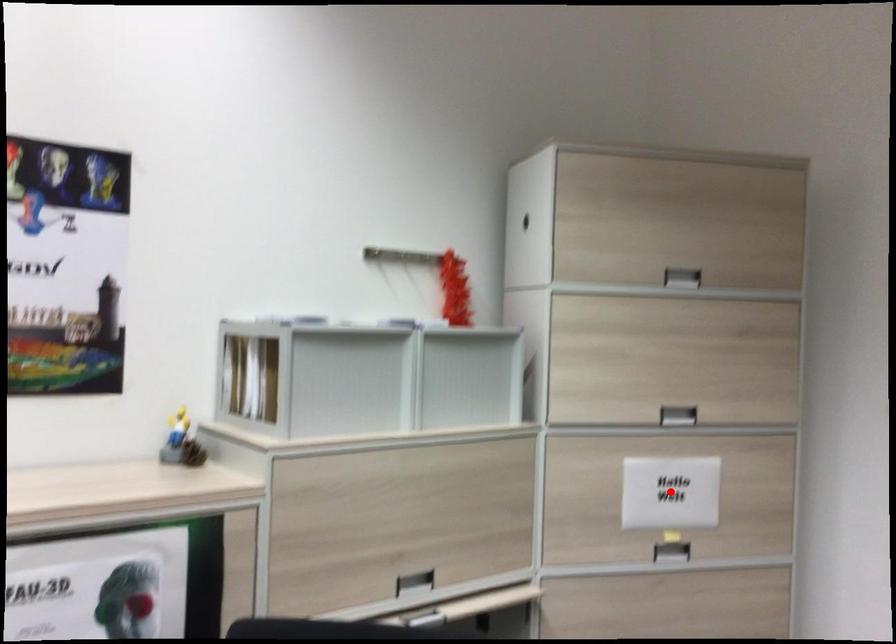
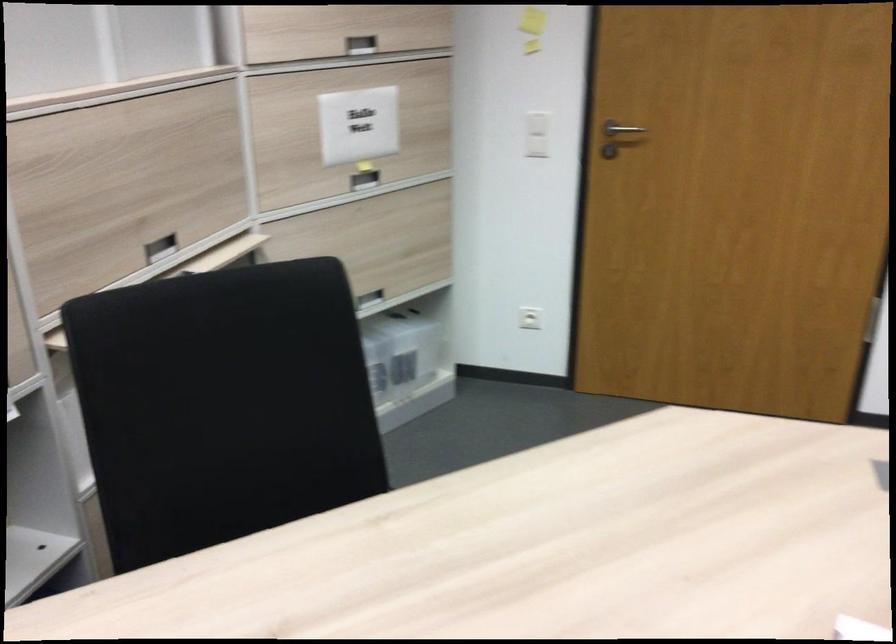
In the second image, find the point that corresponds to the highlighted location in the first image.

(358, 125)